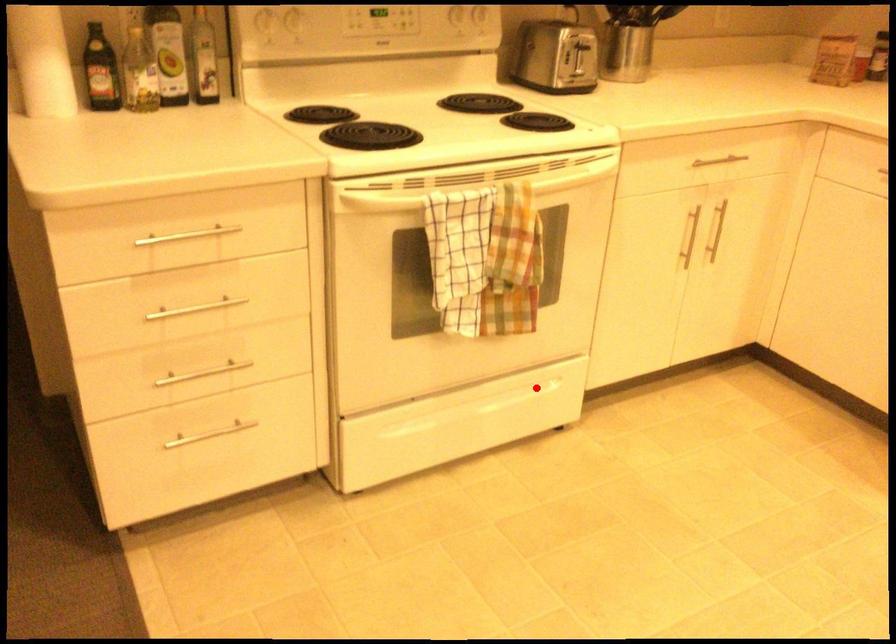
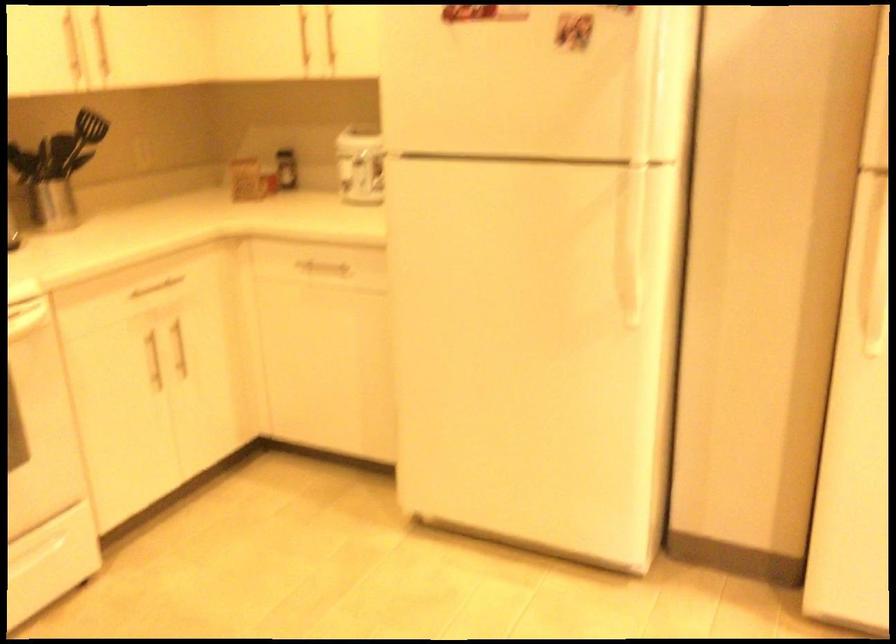
Where in the second image is the point corresponding to the highlighted location from the first image?

(37, 553)